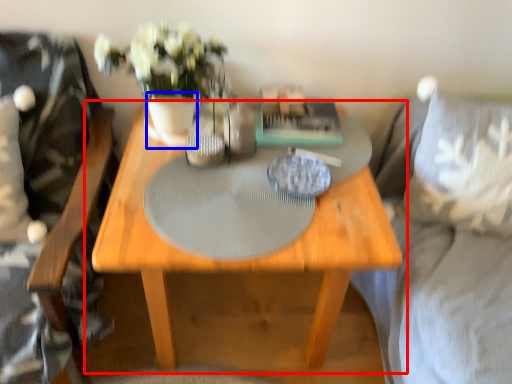
Question: Which of the following is the closest to the observer, table (highlighted by a red box) or vase (highlighted by a blue box)?

Choices:
 (A) table
 (B) vase

Answer: (A)